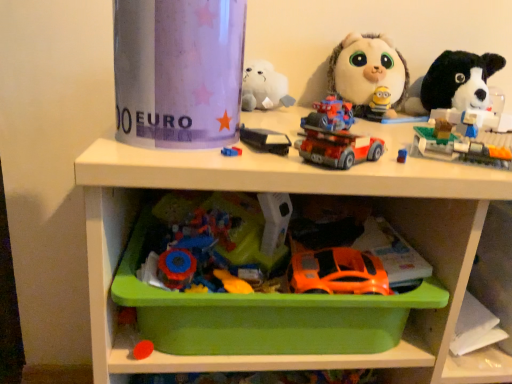
What is the approximate height of black plush dog at upper right, which is counted as the 4th toy, starting from the bottom?

It is 6.32 inches.

What do you see at coordinates (335, 137) in the screenshot?
I see `red plastic car at center, which is the 4th toy from top to bottom` at bounding box center [335, 137].

Where is `translucent plastic building blocks at upper right, which is the third toy from top to bottom`? The height and width of the screenshot is (384, 512). translucent plastic building blocks at upper right, which is the third toy from top to bottom is located at coordinates (464, 145).

The height and width of the screenshot is (384, 512). What do you see at coordinates (367, 72) in the screenshot? I see `fluffy white plush toy at upper right, positioned as the 1th toy in top-to-bottom order` at bounding box center [367, 72].

You are a GUI agent. You are given a task and a screenshot of the screen. Output one action in this format:
    pyautogui.click(x=<x>, y=<y>)
    Task: Click on the black plush dog at upper right, the 2th toy from the top
    
    Given the screenshot: What is the action you would take?
    pyautogui.click(x=459, y=80)

Is red plastic car at center, which is the 4th toy from top to bottom, wider than black plush dog at upper right, the 2th toy from the top?

Incorrect, the width of red plastic car at center, which is the 4th toy from top to bottom, does not surpass that of black plush dog at upper right, the 2th toy from the top.

From a real-world perspective, which is physically below, red plastic car at center, the 2th toy in the bottom-to-top sequence, or black plush dog at upper right, the 2th toy from the top?

red plastic car at center, the 2th toy in the bottom-to-top sequence.

Which is in front, point (358, 161) or point (485, 63)?

The point (358, 161) is more forward.

Who is taller, red plastic car at center, the 2th toy in the bottom-to-top sequence, or black plush dog at upper right, which is counted as the 4th toy, starting from the bottom?

Standing taller between the two is black plush dog at upper right, which is counted as the 4th toy, starting from the bottom.

Is orange matte car at lower center, the 1th toy from the bottom, oriented away from translucent plastic building blocks at upper right, which is the third toy from top to bottom?

orange matte car at lower center, the 1th toy from the bottom, does not have its back to translucent plastic building blocks at upper right, which is the third toy from top to bottom.

Is orange matte car at lower center, the 1th toy from the bottom, located outside translucent plastic building blocks at upper right, the third toy when ordered from bottom to top?

Yes, orange matte car at lower center, the 1th toy from the bottom, is outside of translucent plastic building blocks at upper right, the third toy when ordered from bottom to top.

Can you confirm if orange matte car at lower center, the 1th toy from the bottom, is wider than translucent plastic building blocks at upper right, which is the third toy from top to bottom?

In fact, orange matte car at lower center, the 1th toy from the bottom, might be narrower than translucent plastic building blocks at upper right, which is the third toy from top to bottom.

Considering the sizes of red plastic car at center, the 2th toy in the bottom-to-top sequence, and green plastic tray at lower center in the image, is red plastic car at center, the 2th toy in the bottom-to-top sequence, wider or thinner than green plastic tray at lower center?

Clearly, red plastic car at center, the 2th toy in the bottom-to-top sequence, has less width compared to green plastic tray at lower center.

Measure the distance from red plastic car at center, which is the 4th toy from top to bottom, to green plastic tray at lower center.

A distance of 8.88 inches exists between red plastic car at center, which is the 4th toy from top to bottom, and green plastic tray at lower center.

Considering the positions of point (313, 139) and point (357, 347), is point (313, 139) closer or farther from the camera than point (357, 347)?

Clearly, point (313, 139) is closer to the camera than point (357, 347).

Locate an element on the screen. toy that is the 3rd one above the green plastic tray at lower center (from a real-world perspective) is located at coordinates (335, 137).

Is translucent plastic building blocks at upper right, the third toy when ordered from bottom to top, not within red plastic car at center, which is the 4th toy from top to bottom?

Absolutely, translucent plastic building blocks at upper right, the third toy when ordered from bottom to top, is external to red plastic car at center, which is the 4th toy from top to bottom.

From the image's perspective, which is below, translucent plastic building blocks at upper right, which is the third toy from top to bottom, or red plastic car at center, the 2th toy in the bottom-to-top sequence?

red plastic car at center, the 2th toy in the bottom-to-top sequence, from the image's perspective.

From a real-world perspective, is translucent plastic building blocks at upper right, the third toy when ordered from bottom to top, below red plastic car at center, the 2th toy in the bottom-to-top sequence?

Yes, from a real-world perspective, translucent plastic building blocks at upper right, the third toy when ordered from bottom to top, is below red plastic car at center, the 2th toy in the bottom-to-top sequence.

Considering the points (505, 148) and (349, 159), which point is behind, point (505, 148) or point (349, 159)?

Point (505, 148)

Is the surface of fluffy white plush toy at upper right, positioned as the 1th toy in top-to-bottom order, in direct contact with black plush dog at upper right, which is counted as the 4th toy, starting from the bottom?

No, fluffy white plush toy at upper right, positioned as the 1th toy in top-to-bottom order, is not next to black plush dog at upper right, which is counted as the 4th toy, starting from the bottom.

Which object is positioned more to the left, fluffy white plush toy at upper right, positioned as the 1th toy in top-to-bottom order, or black plush dog at upper right, the 2th toy from the top?

fluffy white plush toy at upper right, positioned as the 1th toy in top-to-bottom order.

Is fluffy white plush toy at upper right, the 5th toy positioned from the bottom, located outside black plush dog at upper right, the 2th toy from the top?

fluffy white plush toy at upper right, the 5th toy positioned from the bottom, lies outside black plush dog at upper right, the 2th toy from the top,'s area.

Is there a large distance between black plush dog at upper right, which is counted as the 4th toy, starting from the bottom, and red plastic car at center, which is the 4th toy from top to bottom?

No, black plush dog at upper right, which is counted as the 4th toy, starting from the bottom, is in close proximity to red plastic car at center, which is the 4th toy from top to bottom.

Between black plush dog at upper right, which is counted as the 4th toy, starting from the bottom, and red plastic car at center, the 2th toy in the bottom-to-top sequence, which one has smaller size?

With smaller size is red plastic car at center, the 2th toy in the bottom-to-top sequence.

From a real-world perspective, is black plush dog at upper right, which is counted as the 4th toy, starting from the bottom, beneath red plastic car at center, which is the 4th toy from top to bottom?

Incorrect, from a real-world perspective, black plush dog at upper right, which is counted as the 4th toy, starting from the bottom, is higher than red plastic car at center, which is the 4th toy from top to bottom.

Which object is more forward, black plush dog at upper right, which is counted as the 4th toy, starting from the bottom, or red plastic car at center, which is the 4th toy from top to bottom?

red plastic car at center, which is the 4th toy from top to bottom.

Is red plastic car at center, which is the 4th toy from top to bottom, oriented towards orange matte car at lower center, the 1th toy from the bottom?

No, red plastic car at center, which is the 4th toy from top to bottom, is not aimed at orange matte car at lower center, the 1th toy from the bottom.

From a real-world perspective, is red plastic car at center, the 2th toy in the bottom-to-top sequence, physically above orange matte car at lower center, the 5th toy positioned from the top?

Yes, from a real-world perspective, red plastic car at center, the 2th toy in the bottom-to-top sequence, is on top of orange matte car at lower center, the 5th toy positioned from the top.

How many degrees apart are the facing directions of red plastic car at center, which is the 4th toy from top to bottom, and orange matte car at lower center, the 1th toy from the bottom?

They differ by 29.5 degrees in their facing directions.

This screenshot has width=512, height=384. I want to click on the 3rd toy in front of the black plush dog at upper right, the 2th toy from the top, so click(x=335, y=137).

Starting from the orange matte car at lower center, the 5th toy positioned from the top, which toy is the 3rd one to the right? Please provide its 2D coordinates.

[(464, 145)]

Which object lies further to the anchor point translucent plastic building blocks at upper right, which is the third toy from top to bottom, black plush dog at upper right, the 2th toy from the top, or orange matte car at lower center, the 5th toy positioned from the top?

orange matte car at lower center, the 5th toy positioned from the top, lies further to translucent plastic building blocks at upper right, which is the third toy from top to bottom, than the other object.

When comparing their distances from black plush dog at upper right, the 2th toy from the top, does red plastic car at center, which is the 4th toy from top to bottom, or translucent plastic building blocks at upper right, the third toy when ordered from bottom to top, seem further?

Based on the image, red plastic car at center, which is the 4th toy from top to bottom, appears to be further to black plush dog at upper right, the 2th toy from the top.

Estimate the real-world distances between objects in this image. Which object is closer to orange matte car at lower center, the 1th toy from the bottom, fluffy white plush toy at upper right, the 5th toy positioned from the bottom, or black plush dog at upper right, which is counted as the 4th toy, starting from the bottom?

fluffy white plush toy at upper right, the 5th toy positioned from the bottom, lies closer to orange matte car at lower center, the 1th toy from the bottom, than the other object.

When comparing their distances from red plastic car at center, the 2th toy in the bottom-to-top sequence, does black plush dog at upper right, which is counted as the 4th toy, starting from the bottom, or green plastic tray at lower center seem closer?

green plastic tray at lower center lies closer to red plastic car at center, the 2th toy in the bottom-to-top sequence, than the other object.

Which object lies further to the anchor point black plush dog at upper right, the 2th toy from the top, fluffy white plush toy at upper right, the 5th toy positioned from the bottom, or red plastic car at center, which is the 4th toy from top to bottom?

Based on the image, red plastic car at center, which is the 4th toy from top to bottom, appears to be further to black plush dog at upper right, the 2th toy from the top.

Estimate the real-world distances between objects in this image. Which object is closer to green plastic tray at lower center, red plastic car at center, the 2th toy in the bottom-to-top sequence, or black plush dog at upper right, the 2th toy from the top?

red plastic car at center, the 2th toy in the bottom-to-top sequence, is positioned closer to the anchor green plastic tray at lower center.

Looking at the image, which one is located further to translucent plastic building blocks at upper right, which is the third toy from top to bottom, black plush dog at upper right, the 2th toy from the top, or fluffy white plush toy at upper right, the 5th toy positioned from the bottom?

fluffy white plush toy at upper right, the 5th toy positioned from the bottom, is further to translucent plastic building blocks at upper right, which is the third toy from top to bottom.

When comparing their distances from red plastic car at center, which is the 4th toy from top to bottom, does black plush dog at upper right, which is counted as the 4th toy, starting from the bottom, or orange matte car at lower center, the 1th toy from the bottom, seem further?

black plush dog at upper right, which is counted as the 4th toy, starting from the bottom, is positioned further to the anchor red plastic car at center, which is the 4th toy from top to bottom.

Identify the location of toy between red plastic car at center, which is the 4th toy from top to bottom, and green plastic tray at lower center from top to bottom. The width and height of the screenshot is (512, 384). (337, 272).

This screenshot has width=512, height=384. I want to click on toy between translucent plastic building blocks at upper right, the third toy when ordered from bottom to top, and orange matte car at lower center, the 5th toy positioned from the top, from top to bottom, so click(x=335, y=137).